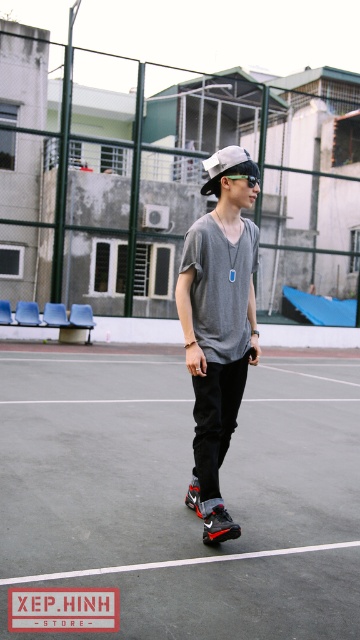
You are standing on the basketball court and want to walk directly to the black rubber tennis court at center. Which direction should you walk?

You should walk towards the center of the court to reach the black rubber tennis court at center, as it is located at point coordinates of (182, 496).